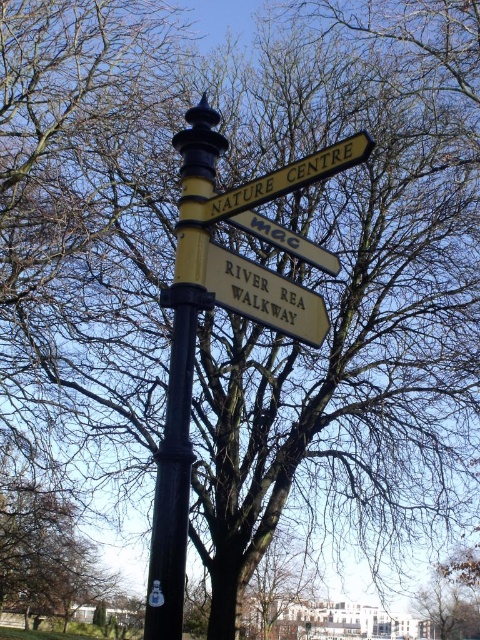
Question: Can you confirm if black matte pole at center is positioned to the left of yellow painted wood sign at upper center?

Choices:
 (A) no
 (B) yes

Answer: (B)

Question: Is black matte pole at center in front of yellow painted wood sign at upper center?

Choices:
 (A) no
 (B) yes

Answer: (A)

Question: Which of the following is the farthest from the observer?

Choices:
 (A) (215, 288)
 (B) (312, 157)

Answer: (A)

Question: Based on their relative distances, which object is farther from the yellow wooden sign at center?

Choices:
 (A) yellow painted wood sign at upper center
 (B) black matte pole at center
 (C) bare branches at center

Answer: (C)

Question: Is yellow painted wood sign at upper center below metallic silver sign at center?

Choices:
 (A) yes
 (B) no

Answer: (B)

Question: Which point is closer to the camera?

Choices:
 (A) (478, 570)
 (B) (158, 484)
 (C) (266, 195)
 (D) (260, 225)

Answer: (B)